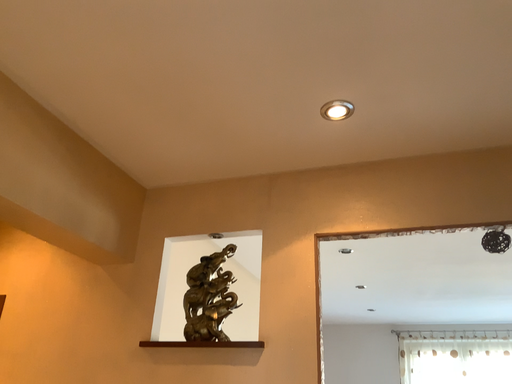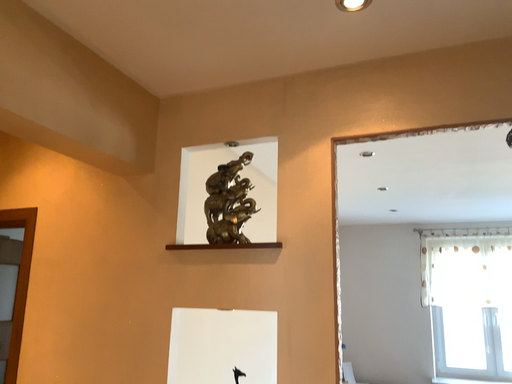
Question: Which way did the camera rotate in the video?

Choices:
 (A) rotated downward
 (B) rotated upward

Answer: (A)